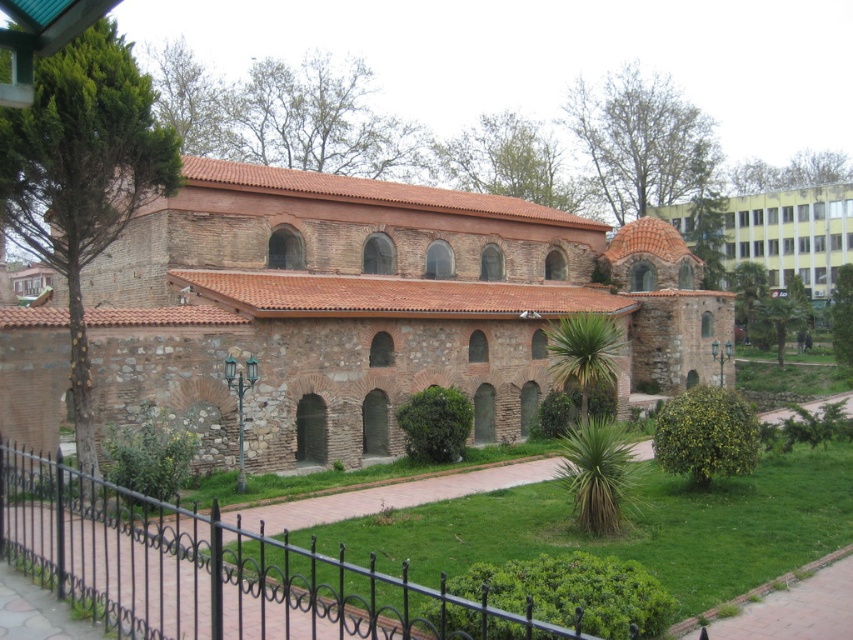
What is the relationship between the width of the brown stone chapel at center and the black wrought iron fence at lower left?

The brown stone chapel at center is wider than the black wrought iron fence at lower left.